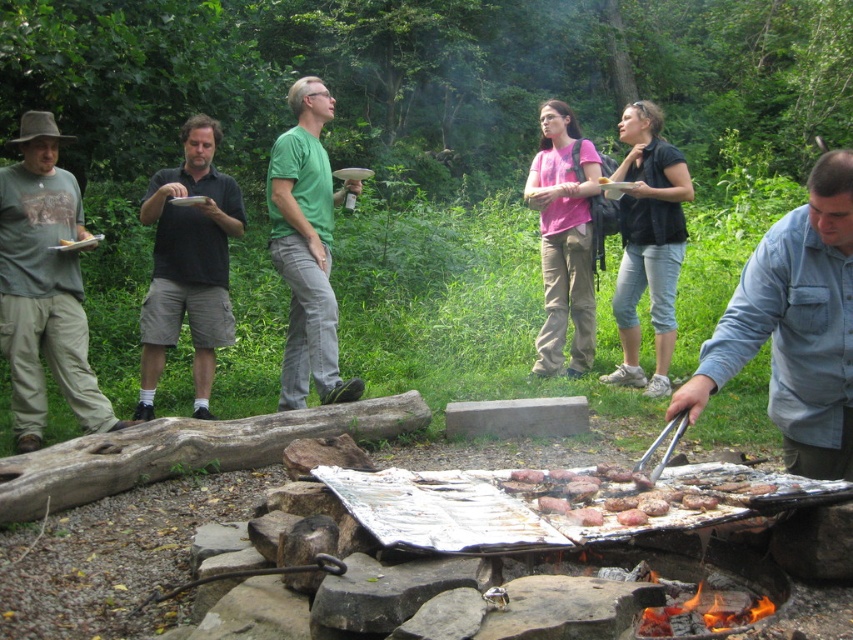
Between matte gray shirt at left and brown matte meat at center, which one has more height?

matte gray shirt at left

Is matte gray shirt at left shorter than brown matte meat at center?

Incorrect, matte gray shirt at left's height does not fall short of brown matte meat at center's.

Between point (25, 202) and point (569, 509), which one is positioned behind?

The point (25, 202) is more distant.

You are a GUI agent. You are given a task and a screenshot of the screen. Output one action in this format:
    pyautogui.click(x=<x>, y=<y>)
    Task: Click on the matte gray shirt at left
    This screenshot has width=853, height=640.
    Given the screenshot: What is the action you would take?
    pyautogui.click(x=44, y=285)

What are the coordinates of `denim shirt at right` in the screenshot? It's located at (793, 326).

The image size is (853, 640). Describe the element at coordinates (793, 326) in the screenshot. I see `denim shirt at right` at that location.

This screenshot has height=640, width=853. I want to click on denim shirt at right, so click(x=793, y=326).

Image resolution: width=853 pixels, height=640 pixels. I want to click on denim shirt at right, so click(x=793, y=326).

Who is more distant from viewer, (202, 132) or (314, 273)?

The point (202, 132) is more distant.

Between point (189, 224) and point (299, 372), which one is positioned behind?

The point (189, 224) is more distant.

Find the location of a particular element. The height and width of the screenshot is (640, 853). black cotton shirt at center is located at coordinates (189, 264).